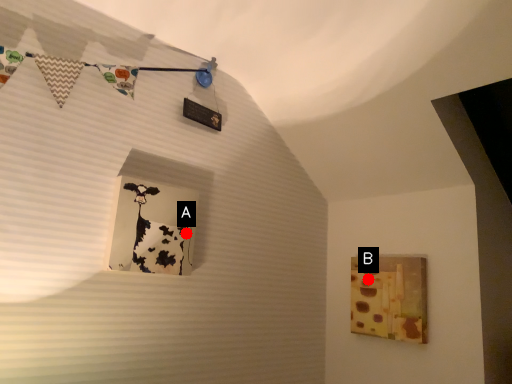
Question: Two points are circled on the image, labeled by A and B beside each circle. Which of the following is the farthest from the observer?

Choices:
 (A) A is further
 (B) B is further

Answer: (B)